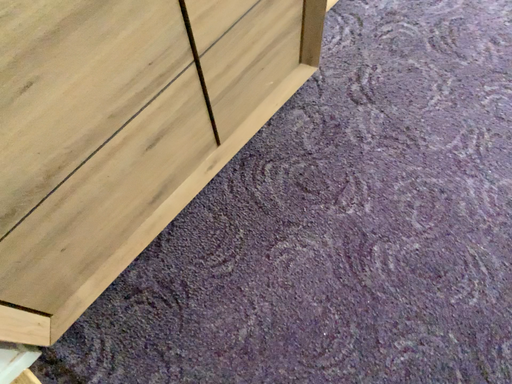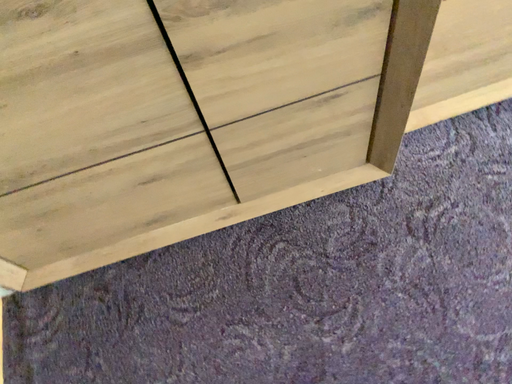
Question: Which way did the camera rotate in the video?

Choices:
 (A) rotated right
 (B) rotated left

Answer: (B)